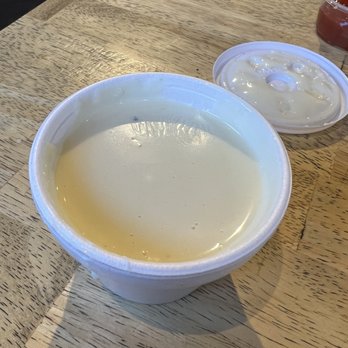
What are the coordinates of `white cup` in the screenshot? It's located at (276, 154).